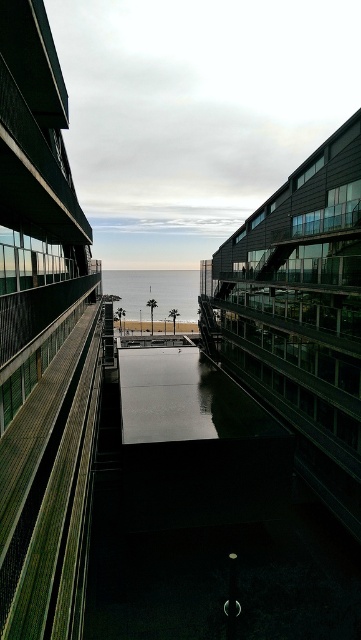
Question: Among these points, which one is farthest from the camera?

Choices:
 (A) (133, 376)
 (B) (193, 294)

Answer: (B)

Question: Does black glass waterway at center have a greater width compared to blue glossy water at center?

Choices:
 (A) yes
 (B) no

Answer: (B)

Question: Which of the following is the farthest from the observer?

Choices:
 (A) blue glossy water at center
 (B) black glass waterway at center

Answer: (A)

Question: Can you confirm if black glass waterway at center is bigger than blue glossy water at center?

Choices:
 (A) no
 (B) yes

Answer: (A)

Question: Can you confirm if black glass waterway at center is positioned below blue glossy water at center?

Choices:
 (A) yes
 (B) no

Answer: (A)